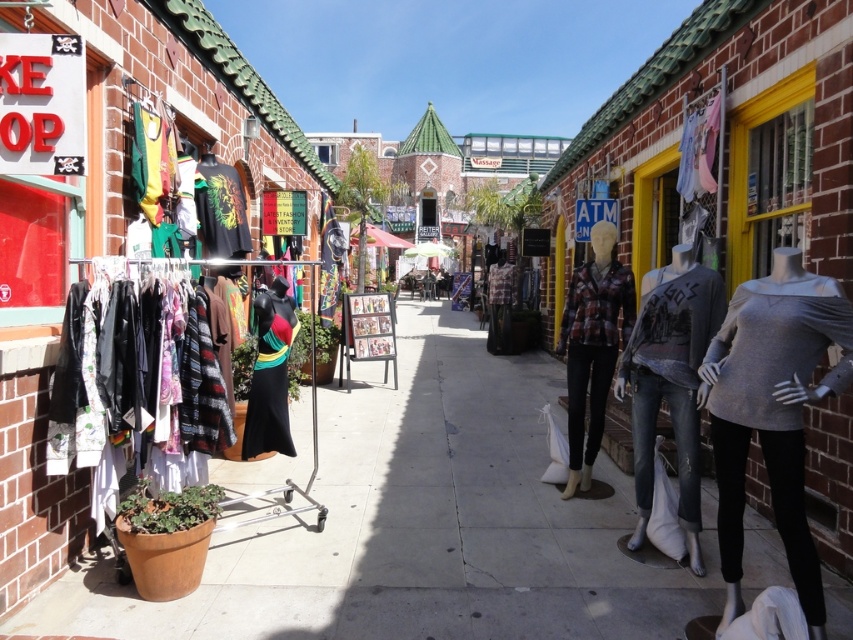
Question: Considering the relative positions of gray matte sweater at center-right and plaid fabric shirt at center in the image provided, where is gray matte sweater at center-right located with respect to plaid fabric shirt at center?

Choices:
 (A) below
 (B) above

Answer: (A)

Question: Which of these objects is positioned closest to the clear glass window at right?

Choices:
 (A) smooth concrete pavement at center
 (B) black matte dress at center

Answer: (A)

Question: Which point is farther from the camera taking this photo?

Choices:
 (A) (563, 349)
 (B) (703, 504)
 (C) (666, 390)
 (D) (773, 97)

Answer: (A)

Question: Which is farther from the plaid fabric shirt at center?

Choices:
 (A) denim jeans at center
 (B) gray matte sweater at center-right
 (C) black matte dress at center

Answer: (C)

Question: Is gray matte sweater at center-right below clear glass window at right?

Choices:
 (A) no
 (B) yes

Answer: (B)

Question: From the image, what is the correct spatial relationship of black matte dress at center in relation to clear glass window at right?

Choices:
 (A) right
 (B) left

Answer: (B)